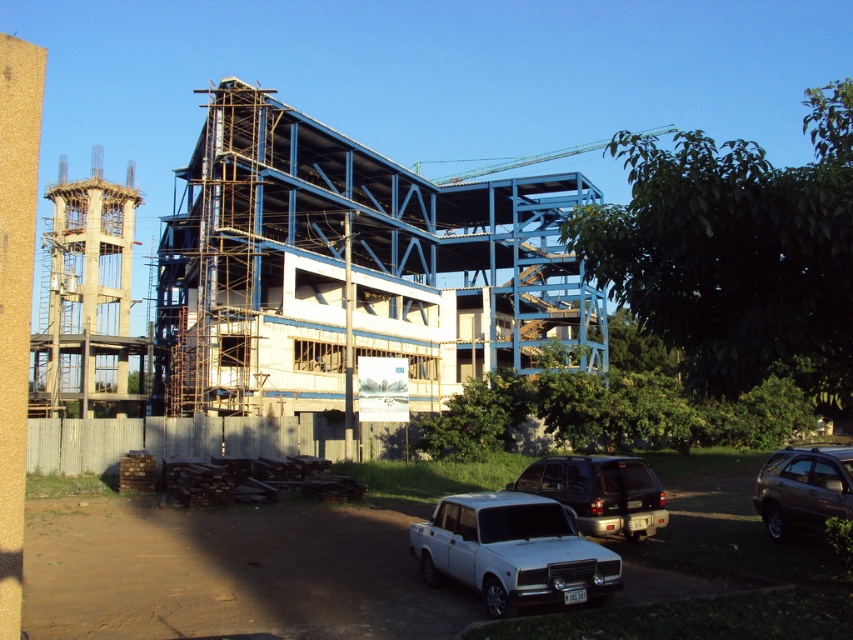
Between point (440, 500) and point (828, 492), which one is positioned behind?

The point (440, 500) is behind.

At what (x,y) coordinates should I click in order to perform the action: click on white matte sedan at lower center. Please return your answer as a coordinate pair (x, y). This screenshot has width=853, height=640. Looking at the image, I should click on (512, 552).

Is white matte sedan at lower center smaller than matte black suv at center?

Actually, white matte sedan at lower center might be larger than matte black suv at center.

Locate an element on the screen. This screenshot has width=853, height=640. white matte sedan at lower center is located at coordinates (512, 552).

Locate an element on the screen. This screenshot has width=853, height=640. white matte sedan at lower center is located at coordinates (512, 552).

Between matte black suv at center and dark brown metallic suv at lower right, which one has less height?

With less height is matte black suv at center.

Measure the distance between matte black suv at center and camera.

They are 13.40 meters apart.

What are the coordinates of `matte black suv at center` in the screenshot? It's located at (601, 492).